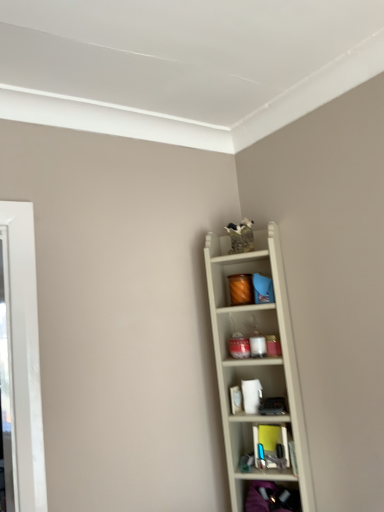
Locate an element on the screen. Image resolution: width=384 pixels, height=512 pixels. matte black shoes at lower right, the second shelf from the top is located at coordinates (271, 498).

This screenshot has width=384, height=512. What do you see at coordinates (271, 498) in the screenshot? I see `matte black shoes at lower right, the 1th shelf in the bottom-to-top sequence` at bounding box center [271, 498].

What do you see at coordinates (256, 362) in the screenshot? Image resolution: width=384 pixels, height=512 pixels. I see `white wood shelf at upper right, the 2th shelf ordered from the bottom` at bounding box center [256, 362].

Where is `white wood shelf at upper right, the 2th shelf ordered from the bottom`? The height and width of the screenshot is (512, 384). white wood shelf at upper right, the 2th shelf ordered from the bottom is located at coordinates (256, 362).

Locate an element on the screen. matte black shoes at lower right, the 1th shelf in the bottom-to-top sequence is located at coordinates (271, 498).

Based on their positions, is white wood shelf at upper right, the 2th shelf ordered from the bottom, located to the left or right of matte black shoes at lower right, the second shelf from the top?

In the image, white wood shelf at upper right, the 2th shelf ordered from the bottom, appears on the left side of matte black shoes at lower right, the second shelf from the top.

Which object is further away from the camera, white wood shelf at upper right, the 2th shelf ordered from the bottom, or matte black shoes at lower right, the second shelf from the top?

Positioned behind is white wood shelf at upper right, the 2th shelf ordered from the bottom.

Does point (253, 372) appear closer or farther from the camera than point (245, 499)?

Point (253, 372) appears to be farther away from the viewer than point (245, 499).

From the image's perspective, is white wood shelf at upper right, the first shelf in the top-to-bottom sequence, on top of matte black shoes at lower right, the second shelf from the top?

Yes, from the image's perspective, white wood shelf at upper right, the first shelf in the top-to-bottom sequence, is over matte black shoes at lower right, the second shelf from the top.

From a real-world perspective, is white wood shelf at upper right, the 2th shelf ordered from the bottom, physically above matte black shoes at lower right, the 1th shelf in the bottom-to-top sequence?

Yes, from a real-world perspective, white wood shelf at upper right, the 2th shelf ordered from the bottom, is over matte black shoes at lower right, the 1th shelf in the bottom-to-top sequence

Which object is thinner, white wood shelf at upper right, the first shelf in the top-to-bottom sequence, or matte black shoes at lower right, the second shelf from the top?

white wood shelf at upper right, the first shelf in the top-to-bottom sequence, is thinner.

Is white wood shelf at upper right, the 2th shelf ordered from the bottom, taller or shorter than matte black shoes at lower right, the second shelf from the top?

Clearly, white wood shelf at upper right, the 2th shelf ordered from the bottom, is taller compared to matte black shoes at lower right, the second shelf from the top.

Which of these two, white wood shelf at upper right, the first shelf in the top-to-bottom sequence, or matte black shoes at lower right, the second shelf from the top, is bigger?

white wood shelf at upper right, the first shelf in the top-to-bottom sequence.

Is white wood shelf at upper right, the first shelf in the top-to-bottom sequence, inside or outside of matte black shoes at lower right, the 1th shelf in the bottom-to-top sequence?

The correct answer is: outside.

Is white wood shelf at upper right, the first shelf in the top-to-bottom sequence, not close to matte black shoes at lower right, the second shelf from the top?

No.

Could you tell me if white wood shelf at upper right, the first shelf in the top-to-bottom sequence, is facing matte black shoes at lower right, the 1th shelf in the bottom-to-top sequence?

Yes, white wood shelf at upper right, the first shelf in the top-to-bottom sequence, is turned towards matte black shoes at lower right, the 1th shelf in the bottom-to-top sequence.

From the picture: How many degrees apart are the facing directions of white wood shelf at upper right, the 2th shelf ordered from the bottom, and matte black shoes at lower right, the second shelf from the top?

The facing directions of white wood shelf at upper right, the 2th shelf ordered from the bottom, and matte black shoes at lower right, the second shelf from the top, are 8.66e-05 degrees apart.

From the picture: How far apart are white wood shelf at upper right, the first shelf in the top-to-bottom sequence, and matte black shoes at lower right, the 1th shelf in the bottom-to-top sequence?

A distance of 13.40 inches exists between white wood shelf at upper right, the first shelf in the top-to-bottom sequence, and matte black shoes at lower right, the 1th shelf in the bottom-to-top sequence.

What are the coordinates of `shelf located in front of the white wood shelf at upper right, the first shelf in the top-to-bottom sequence` in the screenshot? It's located at (271, 498).

Which is more to the left, matte black shoes at lower right, the second shelf from the top, or white wood shelf at upper right, the first shelf in the top-to-bottom sequence?

white wood shelf at upper right, the first shelf in the top-to-bottom sequence.

Which object is further away from the camera, matte black shoes at lower right, the second shelf from the top, or white wood shelf at upper right, the 2th shelf ordered from the bottom?

white wood shelf at upper right, the 2th shelf ordered from the bottom.

Between point (255, 481) and point (233, 307), which one is positioned in front?

The point (255, 481) is closer to the camera.

From the image's perspective, is matte black shoes at lower right, the 1th shelf in the bottom-to-top sequence, located above or below white wood shelf at upper right, the first shelf in the top-to-bottom sequence?

matte black shoes at lower right, the 1th shelf in the bottom-to-top sequence, is below white wood shelf at upper right, the first shelf in the top-to-bottom sequence.

From a real-world perspective, which object rests below the other?

From a 3D spatial view, matte black shoes at lower right, the 1th shelf in the bottom-to-top sequence, is below.

Which object is wider, matte black shoes at lower right, the second shelf from the top, or white wood shelf at upper right, the 2th shelf ordered from the bottom?

matte black shoes at lower right, the second shelf from the top.

Can you confirm if matte black shoes at lower right, the second shelf from the top, is shorter than white wood shelf at upper right, the 2th shelf ordered from the bottom?

Correct, matte black shoes at lower right, the second shelf from the top, is not as tall as white wood shelf at upper right, the 2th shelf ordered from the bottom.

Considering the relative sizes of matte black shoes at lower right, the 1th shelf in the bottom-to-top sequence, and white wood shelf at upper right, the first shelf in the top-to-bottom sequence, in the image provided, is matte black shoes at lower right, the 1th shelf in the bottom-to-top sequence, bigger than white wood shelf at upper right, the first shelf in the top-to-bottom sequence,?

Actually, matte black shoes at lower right, the 1th shelf in the bottom-to-top sequence, might be smaller than white wood shelf at upper right, the first shelf in the top-to-bottom sequence.

Which is correct: matte black shoes at lower right, the 1th shelf in the bottom-to-top sequence, is inside white wood shelf at upper right, the 2th shelf ordered from the bottom, or outside of it?

matte black shoes at lower right, the 1th shelf in the bottom-to-top sequence, is contained in white wood shelf at upper right, the 2th shelf ordered from the bottom.

Is there a large distance between matte black shoes at lower right, the 1th shelf in the bottom-to-top sequence, and white wood shelf at upper right, the 2th shelf ordered from the bottom?

No, matte black shoes at lower right, the 1th shelf in the bottom-to-top sequence, is in close proximity to white wood shelf at upper right, the 2th shelf ordered from the bottom.

Does matte black shoes at lower right, the second shelf from the top, turn towards white wood shelf at upper right, the 2th shelf ordered from the bottom?

Yes, matte black shoes at lower right, the second shelf from the top, is facing white wood shelf at upper right, the 2th shelf ordered from the bottom.

Can you tell me how much matte black shoes at lower right, the second shelf from the top, and white wood shelf at upper right, the 2th shelf ordered from the bottom, differ in facing direction?

8.66e-05 degrees separate the facing orientations of matte black shoes at lower right, the second shelf from the top, and white wood shelf at upper right, the 2th shelf ordered from the bottom.

Find the location of a particular element. This screenshot has width=384, height=512. shelf in front of the white wood shelf at upper right, the first shelf in the top-to-bottom sequence is located at coordinates [x=271, y=498].

The width and height of the screenshot is (384, 512). I want to click on shelf that appears below the white wood shelf at upper right, the 2th shelf ordered from the bottom (from a real-world perspective), so click(271, 498).

The height and width of the screenshot is (512, 384). Identify the location of shelf that is on the left side of matte black shoes at lower right, the second shelf from the top. (256, 362).